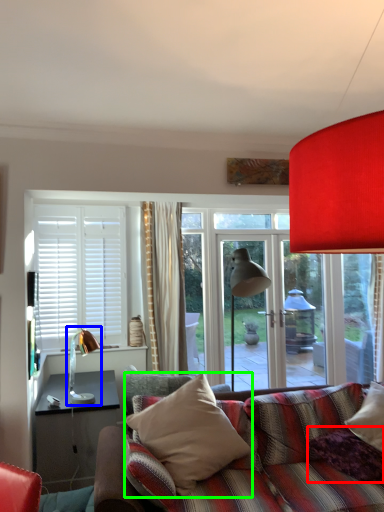
Question: Which object is the farthest from pillow (highlighted by a red box)? Choose among these: table lamp (highlighted by a blue box) or pillow (highlighted by a green box).

Choices:
 (A) table lamp
 (B) pillow

Answer: (A)